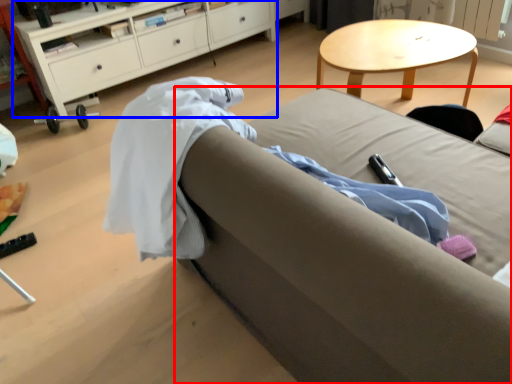
Question: Which point is closer to the camera, studio couch (highlighted by a red box) or cabinetry (highlighted by a blue box)?

Choices:
 (A) studio couch
 (B) cabinetry

Answer: (A)